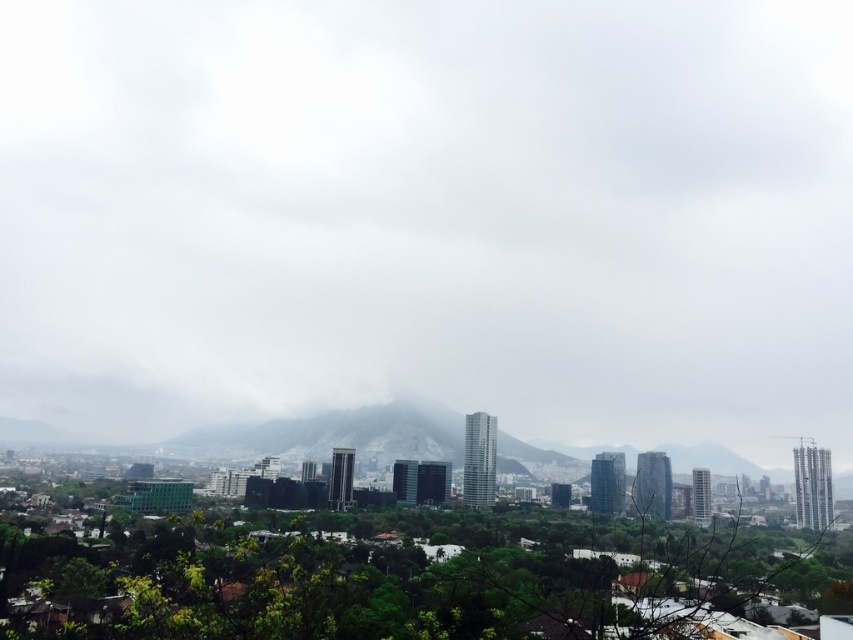
You are an architect designing a new observation deck. You want to ensure that the deck provides a clear view of both the white fluffy cloud at center and the gray foggy mountain at center. Based on their positions, which object will appear closer to the deck when viewed from the same vantage point?

The white fluffy cloud at center appears closer to the deck than the gray foggy mountain at center because it is taller in the scene.

You are a drone operator planning to fly a drone between the white fluffy cloud at center and the gray foggy mountain at center. The drone has a maximum flight distance of 500 feet. Can the drone safely travel from one to the other without exceeding its range?

The white fluffy cloud at center and gray foggy mountain at center are 609.86 feet apart from each other. Since the drone can only fly up to 500 feet, it cannot safely travel between them without exceeding its range.

You are a city planner analyzing the cityscape. You notice the white fluffy cloud at center and the gray foggy mountain at center. Which object occupies more horizontal space in the image?

The white fluffy cloud at center has a greater width than the gray foggy mountain at center, so it occupies more horizontal space.